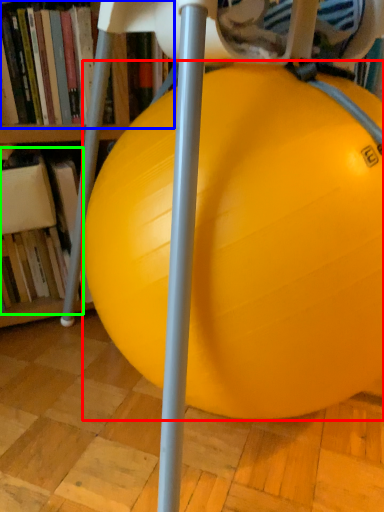
Question: Based on their relative distances, which object is farther from ball (highlighted by a red box)? Choose from book (highlighted by a blue box) and book (highlighted by a green box).

Choices:
 (A) book
 (B) book

Answer: (B)